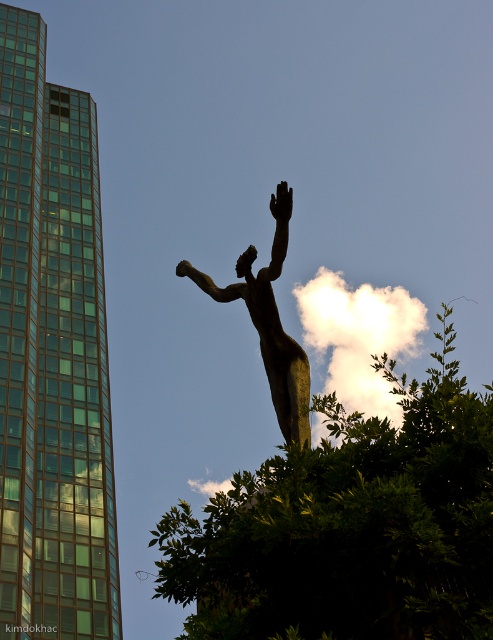
Question: Which point is closer to the camera taking this photo?

Choices:
 (A) (206, 636)
 (B) (278, 220)
 (C) (275, 316)

Answer: (A)

Question: Does green leafy tree at center have a larger size compared to bronze at center?

Choices:
 (A) yes
 (B) no

Answer: (A)

Question: Does bronze statue at center have a smaller size compared to bronze statue hand at upper center?

Choices:
 (A) yes
 (B) no

Answer: (B)

Question: Which object appears farthest from the camera in this image?

Choices:
 (A) bronze statue at center
 (B) bronze at center

Answer: (B)

Question: Which object is closer to the camera taking this photo?

Choices:
 (A) green leafy tree at center
 (B) bronze statue at center
 (C) bronze at center
 (D) black matte hand at upper center

Answer: (A)

Question: Can you confirm if bronze at center is positioned to the left of bronze statue hand at upper center?

Choices:
 (A) no
 (B) yes

Answer: (A)